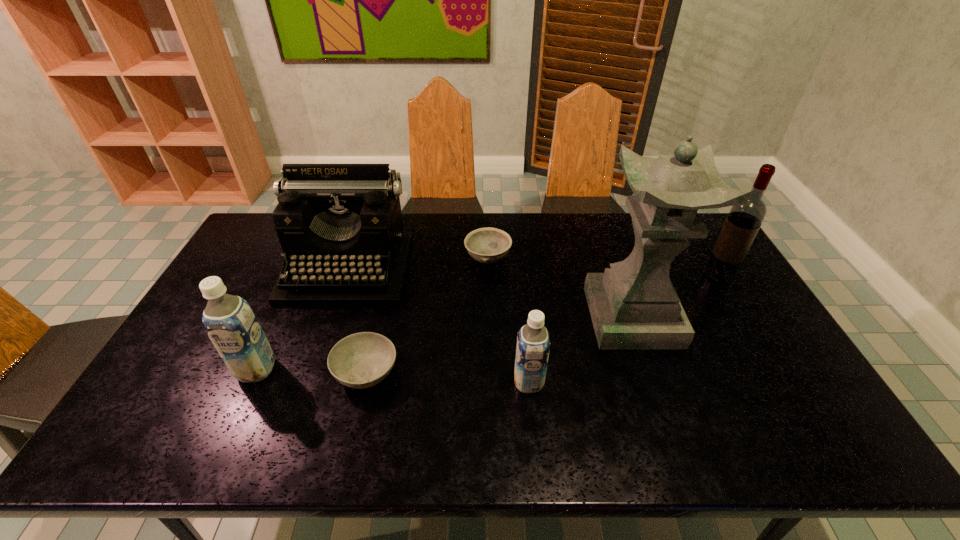
Image resolution: width=960 pixels, height=540 pixels. What are the coordinates of `the left soya milk` in the screenshot? It's located at (229, 320).

At what (x,y) coordinates should I click in order to perform the action: click on the fifth tallest object. Please return your answer as a coordinate pair (x, y). Looking at the image, I should click on (533, 343).

Identify the location of the shorter soya milk. This screenshot has width=960, height=540. (533, 343).

The height and width of the screenshot is (540, 960). In order to click on the right bowl in this screenshot , I will do `click(488, 245)`.

At what (x,y) coordinates should I click in order to perform the action: click on the second object from right to left. Please return your answer as a coordinate pair (x, y). The height and width of the screenshot is (540, 960). Looking at the image, I should click on (633, 305).

Where is `the tallest object`? Image resolution: width=960 pixels, height=540 pixels. the tallest object is located at coordinates (633, 305).

Identify the location of the rightmost object. The image size is (960, 540). (743, 222).

I want to click on wine bottle, so click(x=743, y=222).

You are a GUI agent. You are given a task and a screenshot of the screen. Output one action in this format:
    pyautogui.click(x=<x>, y=<y>)
    Task: Click on the typewriter
    
    Given the screenshot: What is the action you would take?
    pyautogui.click(x=340, y=226)

Locate an element on the screen. The height and width of the screenshot is (540, 960). the nearer bowl is located at coordinates (361, 360).